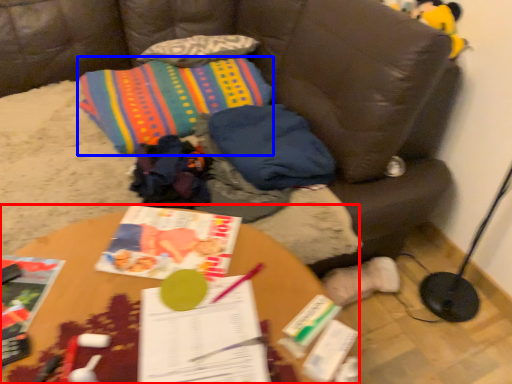
Question: Which object appears farthest to the camera in this image, table (highlighted by a red box) or throw pillow (highlighted by a blue box)?

Choices:
 (A) table
 (B) throw pillow

Answer: (B)